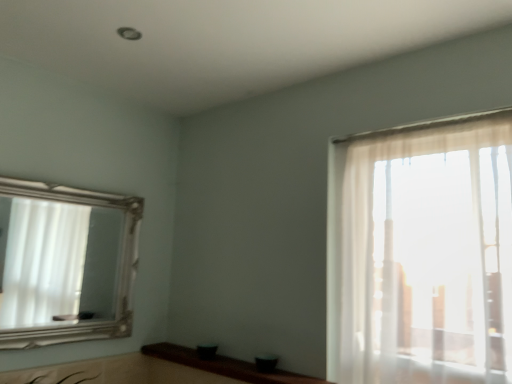
Find the location of `free space above silver/golden frame mirror at left (from a real-world perspective)`. free space above silver/golden frame mirror at left (from a real-world perspective) is located at coordinates (61, 186).